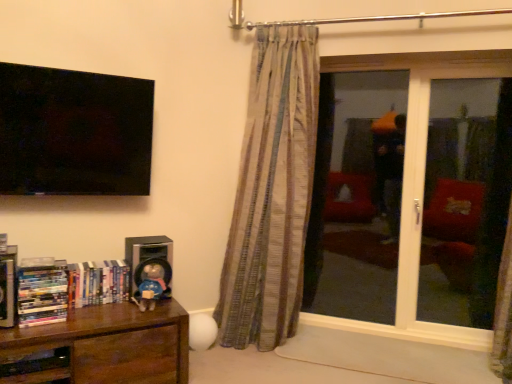
Locate an element on the screen. Image resolution: width=512 pixels, height=384 pixels. free space in front of multicolored plastic books at lower left, the second book in the right-to-left sequence is located at coordinates (34, 327).